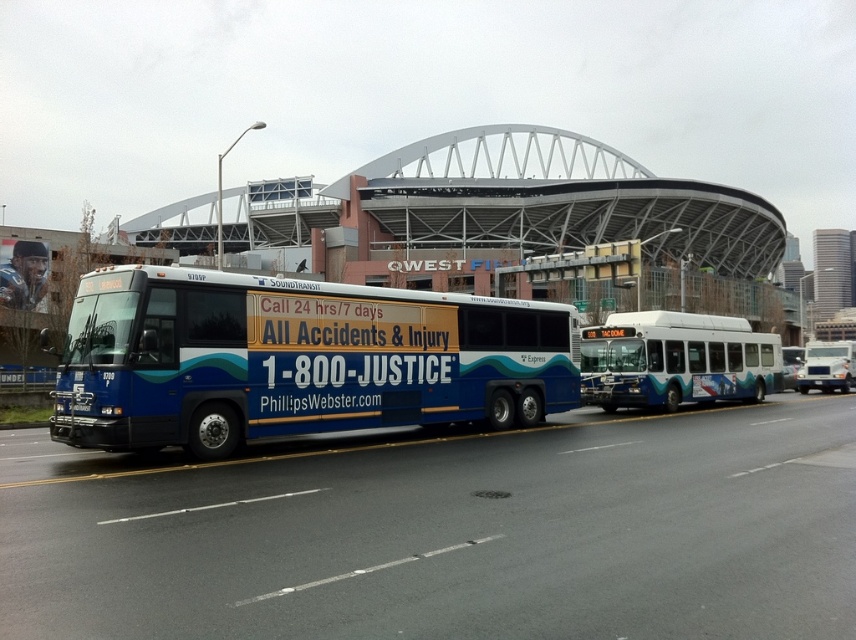
The image size is (856, 640). Describe the element at coordinates (676, 360) in the screenshot. I see `white glossy bus at center` at that location.

Which is behind, point (607, 410) or point (807, 344)?

Point (807, 344)

Between point (777, 362) and point (821, 380), which one is positioned in front?

Point (777, 362)

Locate an element on the screen. white glossy bus at center is located at coordinates (676, 360).

Can you confirm if blue metallic bus at center is smaller than white matte truck at center?

Yes.

Identify the location of blue metallic bus at center. The height and width of the screenshot is (640, 856). (296, 358).

Does point (72, 336) come closer to viewer compared to point (824, 349)?

Yes, point (72, 336) is closer to viewer.

Where is `blue metallic bus at center`? This screenshot has width=856, height=640. blue metallic bus at center is located at coordinates (296, 358).

Measure the distance from blue metallic bus at center to white glossy bus at center.

blue metallic bus at center is 7.96 meters away from white glossy bus at center.

Does blue metallic bus at center appear on the right side of white glossy bus at center?

Incorrect, blue metallic bus at center is not on the right side of white glossy bus at center.

Does point (238, 323) come behind point (703, 337)?

No, it is not.

You are a GUI agent. You are given a task and a screenshot of the screen. Output one action in this format:
    pyautogui.click(x=<x>, y=<y>)
    Task: Click on the blue metallic bus at center
    This screenshot has width=856, height=640.
    Given the screenshot: What is the action you would take?
    pyautogui.click(x=296, y=358)